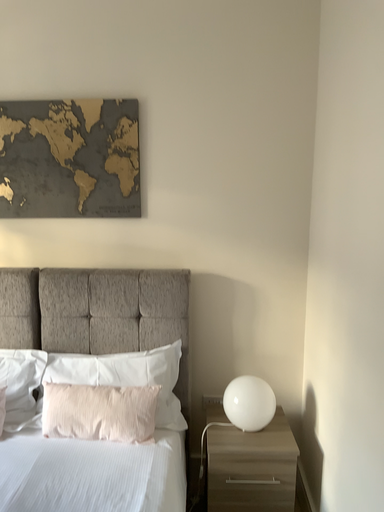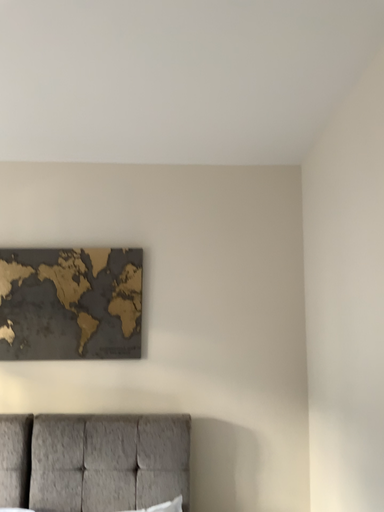
Question: How did the camera likely rotate when shooting the video?

Choices:
 (A) rotated upward
 (B) rotated downward

Answer: (A)